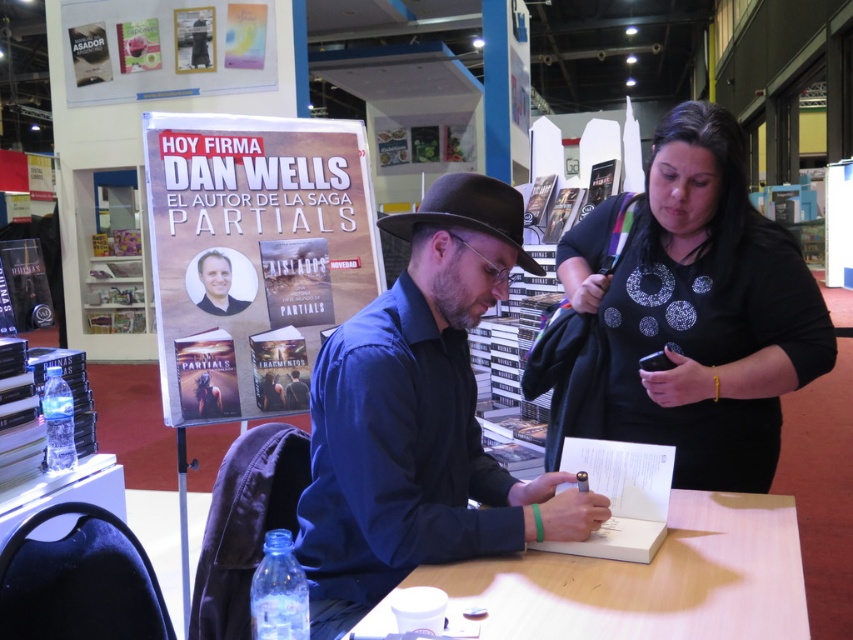
Question: Which object appears closest to the camera in this image?

Choices:
 (A) light brown wooden table at center
 (B) blue cotton shirt at center
 (C) white paper poster at center
 (D) black matte shirt at center

Answer: (A)

Question: Can you confirm if blue cotton shirt at center is positioned above white paper poster at center?

Choices:
 (A) no
 (B) yes

Answer: (A)

Question: Is blue cotton shirt at center bigger than matte paper poster at upper left?

Choices:
 (A) yes
 (B) no

Answer: (B)

Question: Which point is closer to the camera taking this photo?

Choices:
 (A) (793, 285)
 (B) (189, 401)
 (C) (753, 586)

Answer: (C)

Question: Can you confirm if blue cotton shirt at center is positioned to the left of white paper poster at center?

Choices:
 (A) no
 (B) yes

Answer: (A)

Question: Which point appears closest to the camera in this image?

Choices:
 (A) (526, 497)
 (B) (479, 564)
 (C) (338, 276)
 (D) (62, 20)

Answer: (B)